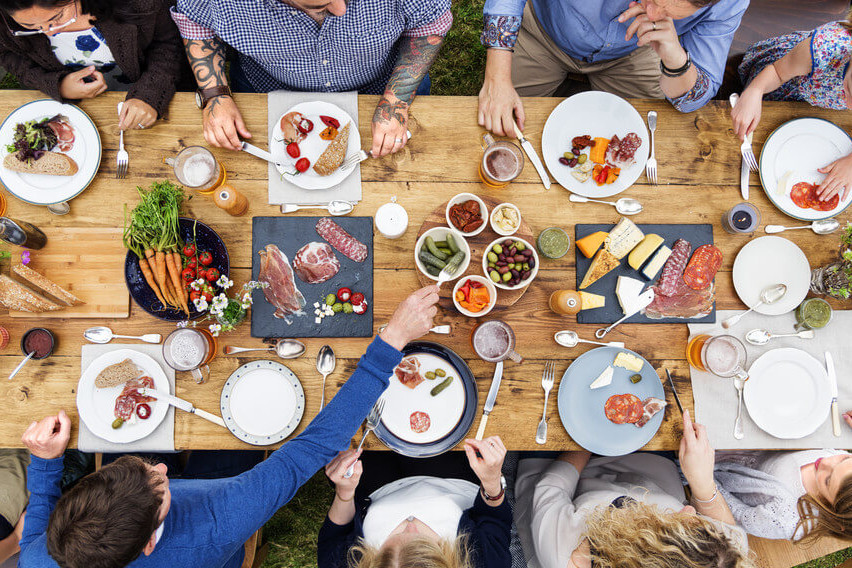
You are a GUI agent. You are given a task and a screenshot of the screen. Output one action in this format:
    pyautogui.click(x=<x>, y=<y>)
    Task: Click on the spoon
    
    Given the screenshot: What is the action you would take?
    pyautogui.click(x=338, y=207), pyautogui.click(x=626, y=204), pyautogui.click(x=829, y=223), pyautogui.click(x=761, y=336), pyautogui.click(x=772, y=294), pyautogui.click(x=563, y=334), pyautogui.click(x=327, y=367), pyautogui.click(x=291, y=353), pyautogui.click(x=101, y=335)